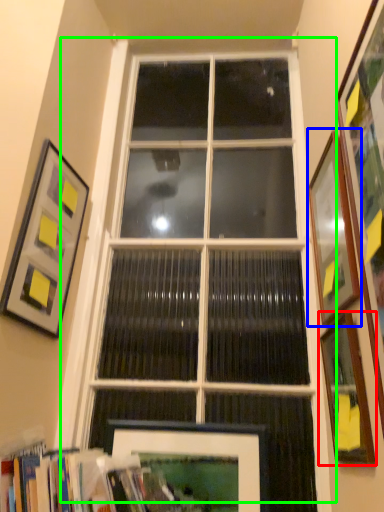
Question: Estimate the real-world distances between objects in this image. Which object is farther from picture frame (highlighted by a red box), picture frame (highlighted by a blue box) or window (highlighted by a green box)?

Choices:
 (A) picture frame
 (B) window

Answer: (B)